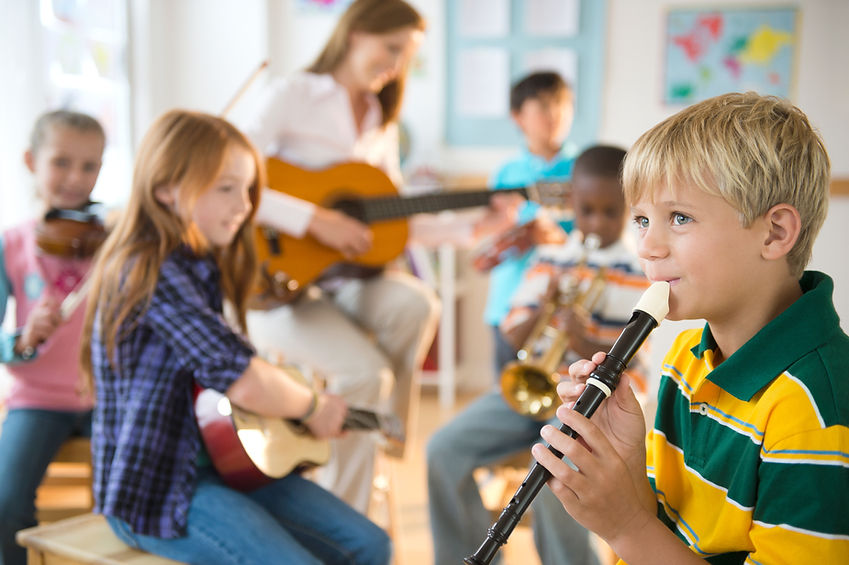
Locate an element on the screen. window is located at coordinates (91, 89), (239, 43).